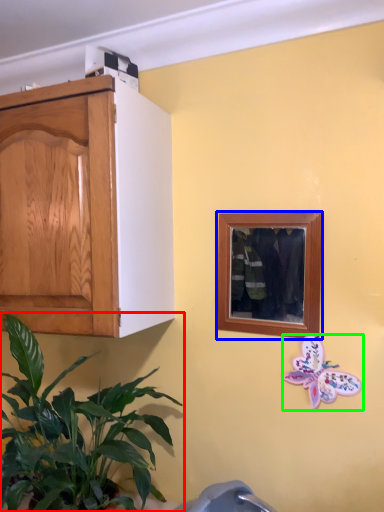
Question: Which object is the closest to the houseplant (highlighted by a red box)? Choose among these: picture frame (highlighted by a blue box) or butterfly (highlighted by a green box).

Choices:
 (A) picture frame
 (B) butterfly

Answer: (A)